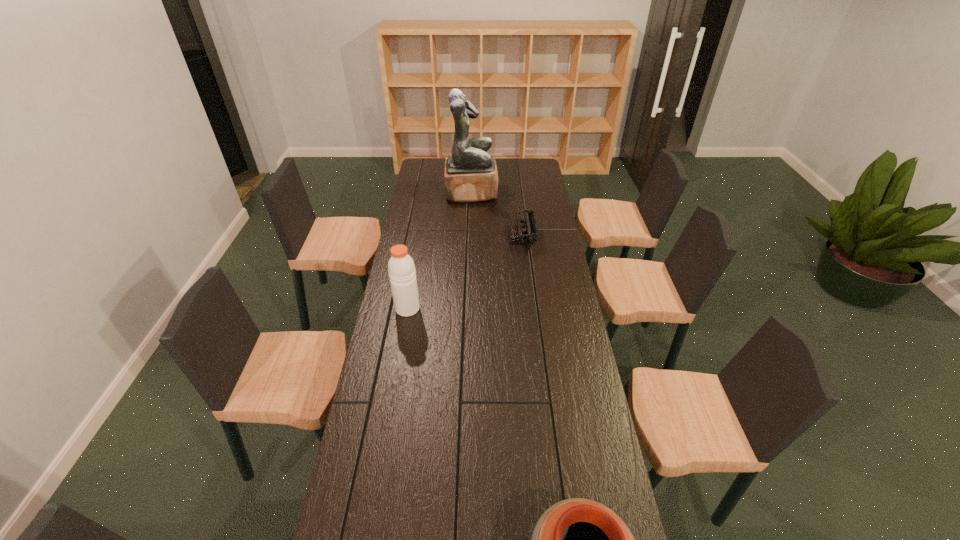
The image size is (960, 540). Find the location of `blank space located on the typing side of the second farthest object`. blank space located on the typing side of the second farthest object is located at coordinates (456, 237).

Where is `object situated at the left edge`? Image resolution: width=960 pixels, height=540 pixels. object situated at the left edge is located at coordinates (401, 267).

Find the location of a particular element. The height and width of the screenshot is (540, 960). object that is at the right edge is located at coordinates (525, 234).

Where is `vacant space at the far edge of the desktop`? The height and width of the screenshot is (540, 960). vacant space at the far edge of the desktop is located at coordinates (511, 160).

You are a GUI agent. You are given a task and a screenshot of the screen. Output one action in this format:
    pyautogui.click(x=<x>, y=<y>)
    Task: Click on the vacant space at the left edge of the desktop
    This screenshot has height=540, width=960.
    Given the screenshot: What is the action you would take?
    pyautogui.click(x=430, y=268)

Identify the location of vacant space at the right edge of the desktop. (540, 241).

Find the location of a particular element. The width and height of the screenshot is (960, 540). vacant area at the far left corner of the desktop is located at coordinates (443, 165).

This screenshot has width=960, height=540. Identify the location of vacant space at the far right corner of the desktop. (529, 177).

You are a GUI agent. You are given a task and a screenshot of the screen. Output one action in this format:
    pyautogui.click(x=<x>, y=<y>)
    Task: Click on the free space between the tallest object and the third nearest object
    
    Given the screenshot: What is the action you would take?
    pyautogui.click(x=496, y=214)

This screenshot has width=960, height=540. In order to click on vacant space that is in between the shortest object and the farthest object in this screenshot , I will do `click(496, 214)`.